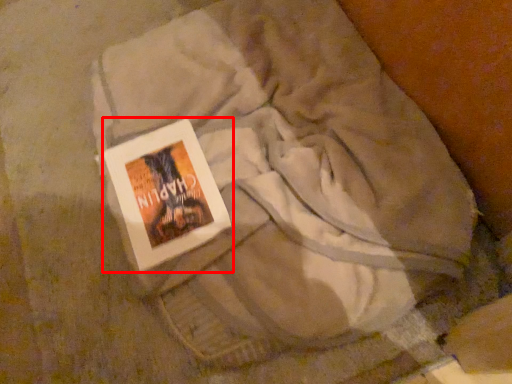
Question: From the image's perspective, where is book (annotated by the red box) located in relation to textile in the image?

Choices:
 (A) below
 (B) above

Answer: (A)